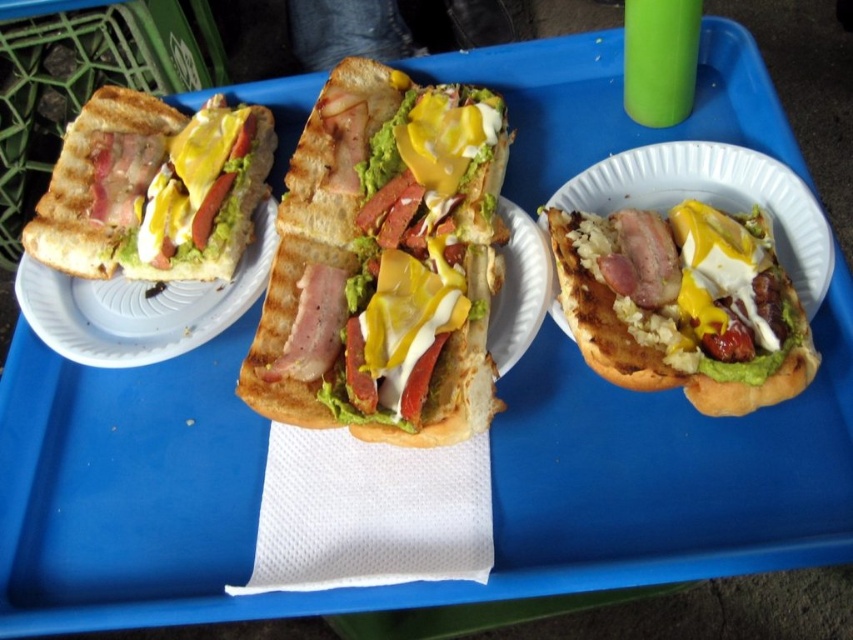
Between grilled bread sandwich at center and matte black sandwich at left, which one has less height?

matte black sandwich at left

You are a GUI agent. You are given a task and a screenshot of the screen. Output one action in this format:
    pyautogui.click(x=<x>, y=<y>)
    Task: Click on the grilled bread sandwich at center
    
    Given the screenshot: What is the action you would take?
    tap(386, 262)

Does point (473, 326) come behind point (189, 240)?

That is False.

Find the location of `grilled bread sandwich at center`. grilled bread sandwich at center is located at coordinates (386, 262).

Is point (218, 220) positioned in front of point (238, 269)?

Yes, point (218, 220) is in front of point (238, 269).

The width and height of the screenshot is (853, 640). Describe the element at coordinates (154, 189) in the screenshot. I see `matte black sandwich at left` at that location.

What do you see at coordinates (154, 189) in the screenshot? Image resolution: width=853 pixels, height=640 pixels. I see `matte black sandwich at left` at bounding box center [154, 189].

Image resolution: width=853 pixels, height=640 pixels. Find the location of `matte black sandwich at left`. matte black sandwich at left is located at coordinates (154, 189).

Describe the element at coordinates (386, 262) in the screenshot. I see `grilled bread sandwich at center` at that location.

Which of these two, grilled bread sandwich at center or yellow creamy cheese at center, stands shorter?

Standing shorter between the two is yellow creamy cheese at center.

Between point (366, 368) and point (703, 308), which one is positioned behind?

Positioned behind is point (366, 368).

The width and height of the screenshot is (853, 640). In order to click on grilled bread sandwich at center in this screenshot , I will do `click(386, 262)`.